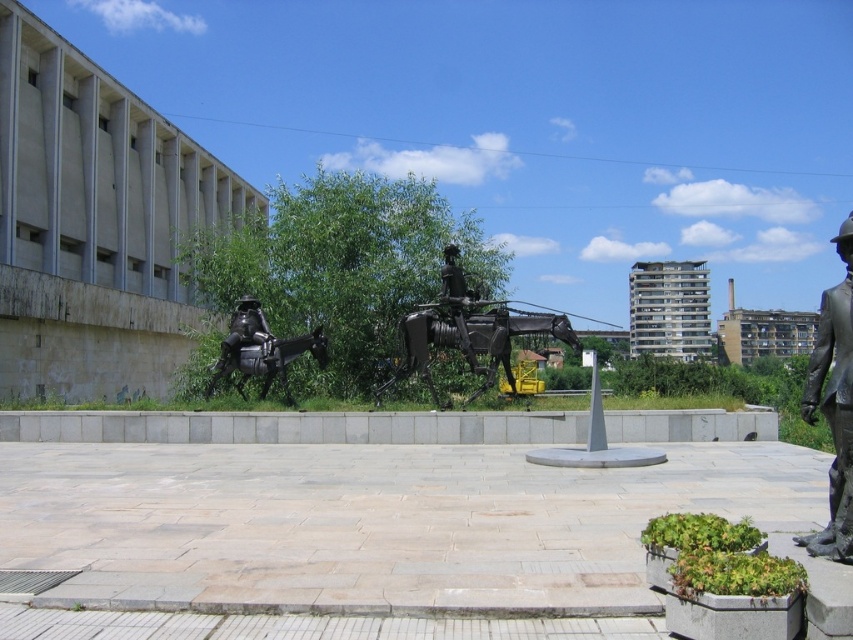
You are a photographer planning to take a photo of the bronze statue at right and the shiny black horse at center. To ensure both subjects are in focus, you need to know their vertical positions. Which one is higher?

The bronze statue at right is above the shiny black horse at center, so it is higher.

You are a photographer planning to take a photo of both the bronze statue at right and the shiny black horse at center. Given that you want both subjects to be clearly visible in the frame, which object should you position closer to the camera to ensure proper focus and visibility?

The bronze statue at right is much taller than the shiny black horse at center. To ensure both are clearly visible, position the camera closer to the shiny black horse at center so that the height difference is minimized in the photo.